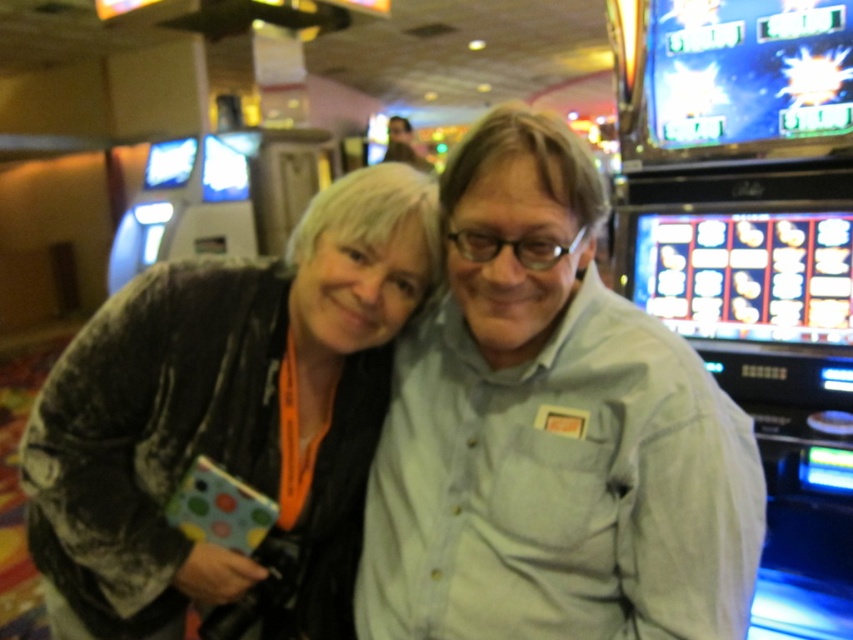
Which is behind, point (398, 392) or point (283, 488)?

The point (398, 392) is more distant.

Locate an element on the screen. light gray button-up shirt at center is located at coordinates (550, 432).

Find the location of a particular element. The image size is (853, 640). light gray button-up shirt at center is located at coordinates (550, 432).

Locate an element on the screen. The height and width of the screenshot is (640, 853). light gray button-up shirt at center is located at coordinates click(x=550, y=432).